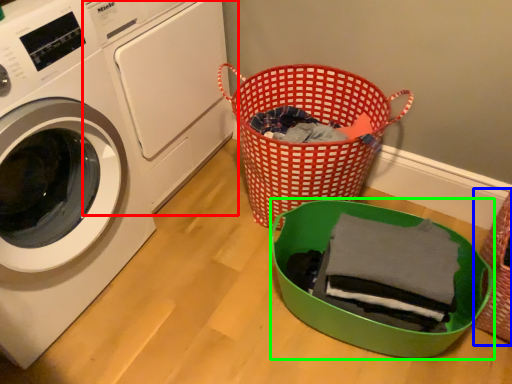
Question: Which is farther away from washing machine (highlighted by a red box)? basket (highlighted by a blue box) or basket (highlighted by a green box)?

Choices:
 (A) basket
 (B) basket

Answer: (A)